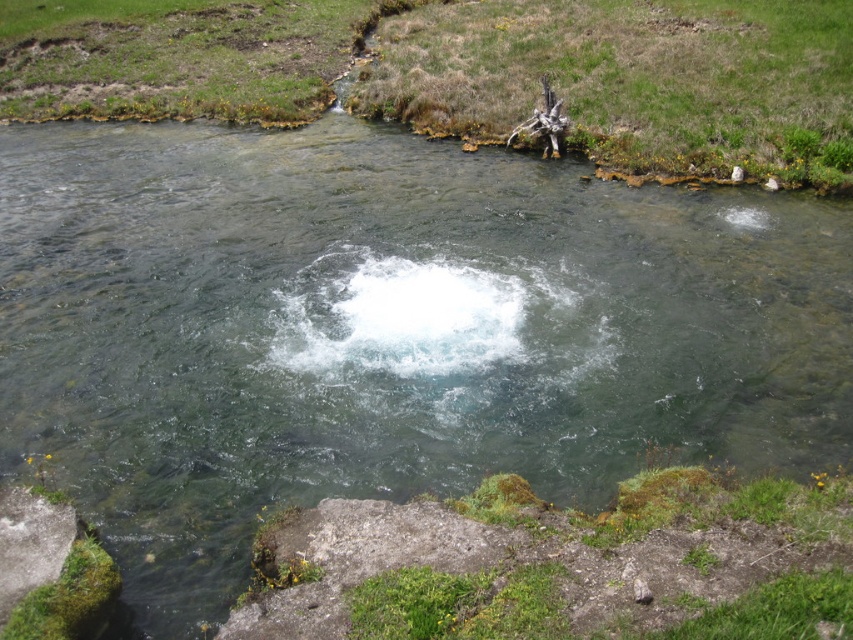
Does gray rough rock at lower left have a larger size compared to brown wood log at upper right?

No, gray rough rock at lower left is not bigger than brown wood log at upper right.

The height and width of the screenshot is (640, 853). I want to click on gray rough rock at lower left, so pyautogui.click(x=30, y=544).